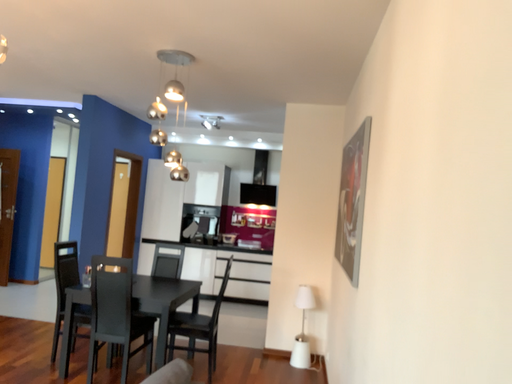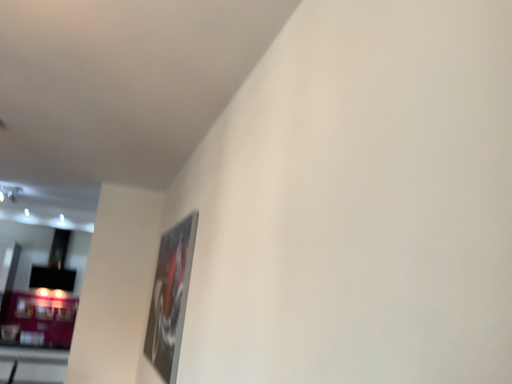
Question: How did the camera likely rotate when shooting the video?

Choices:
 (A) rotated downward
 (B) rotated upward

Answer: (B)